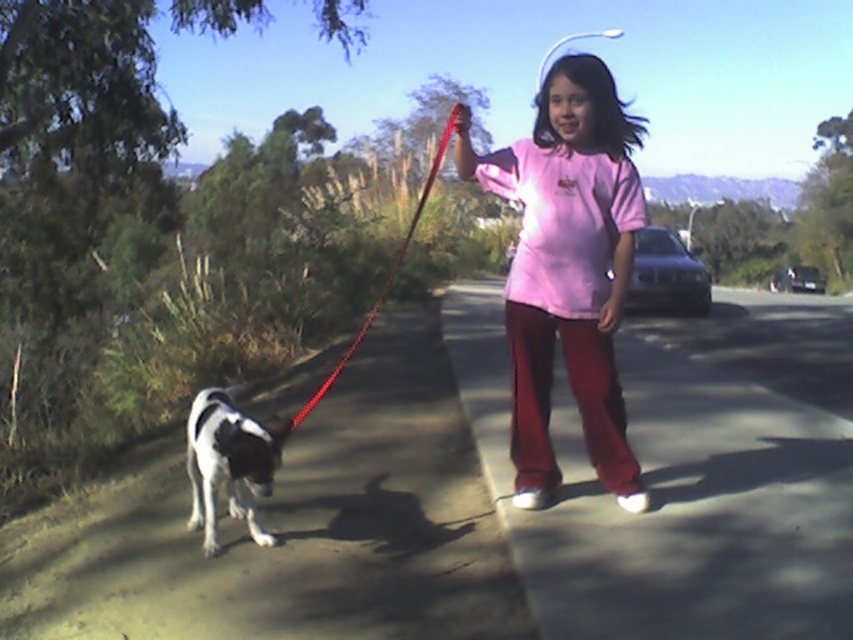
Question: Which of these objects is positioned farthest from the pink cotton shirt at center?

Choices:
 (A) red nylon leash at center
 (B) smooth concrete path at lower left

Answer: (A)

Question: Does smooth asphalt road at center appear on the right side of red nylon leash at center?

Choices:
 (A) yes
 (B) no

Answer: (A)

Question: Is black and white fur at lower left smaller than red nylon leash at center?

Choices:
 (A) no
 (B) yes

Answer: (B)

Question: Which point is farther to the camera?

Choices:
 (A) smooth concrete path at lower left
 (B) pink cotton shirt at center

Answer: (B)

Question: Is black and white fur at lower left thinner than red nylon leash at center?

Choices:
 (A) no
 (B) yes

Answer: (B)

Question: Which object is positioned closest to the smooth concrete path at lower left?

Choices:
 (A) smooth asphalt road at center
 (B) black and white fur at lower left

Answer: (B)